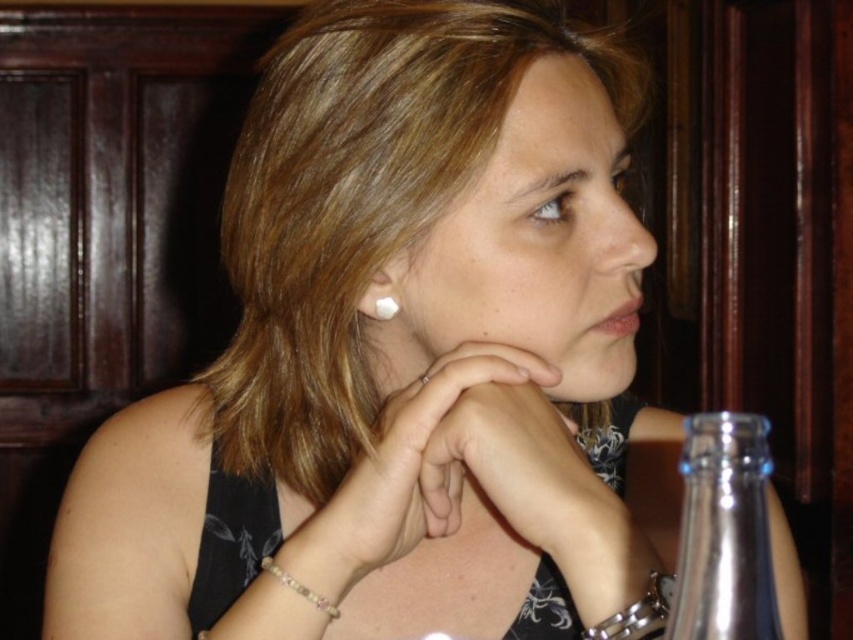
Based on the scene description, can you determine if the pale skin at center is wider than the silver metallic chain at lower right?

The Objects Description states that pale skin at center might be wider than silver metallic chain at lower right.

You are a photographer trying to capture a closeup of the clear glass bottle at right. The camera you are using has a minimum focusing distance of 12 inches. Can you take the photo without moving either the camera or the bottle?

The clear glass bottle at right and camera are 12.19 inches apart. Since the minimum focusing distance is 12 inches, the photographer can take the photo without moving either the camera or the bottle because the distance is slightly more than the required minimum.

You are a photographer setting up a shoot. You need to ensure that the clear glass bottle at right and the pearlelegantearring at ear are visible in the frame. Based on their sizes, which object will require more space horizontally in the composition?

The clear glass bottle at right requires more horizontal space in the composition because its width surpasses that of the pearlelegantearring at ear.